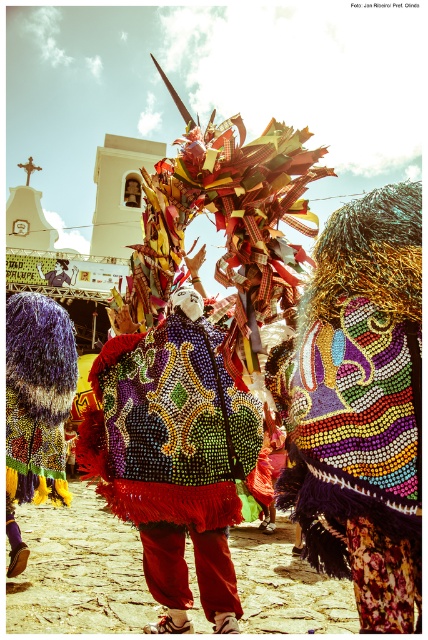
Is shiny sequined vest at center shorter than shiny sequined mask at center?

Incorrect, shiny sequined vest at center's height does not fall short of shiny sequined mask at center's.

Which is more to the left, shiny sequined vest at center or shiny sequined mask at center?

From the viewer's perspective, shiny sequined vest at center appears more on the left side.

Between point (175, 509) and point (409, 566), which one is positioned behind?

Positioned behind is point (175, 509).

Find the location of `shiny sequined vest at center`. shiny sequined vest at center is located at coordinates (175, 456).